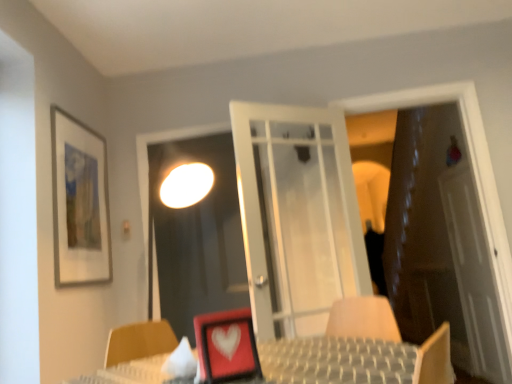
Find the location of a particular element. Image resolution: width=512 pixels, height=384 pixels. matte glass picture frame at upper left, positioned as the 2th picture frame in front-to-back order is located at coordinates (79, 202).

Where is `matte red picture frame at center, which is the first picture frame in right-to-left order`? matte red picture frame at center, which is the first picture frame in right-to-left order is located at coordinates (226, 346).

Where is `matte glass picture frame at upper left, positioned as the 2th picture frame in front-to-back order`? The height and width of the screenshot is (384, 512). matte glass picture frame at upper left, positioned as the 2th picture frame in front-to-back order is located at coordinates (79, 202).

Visually, is brown leather door at right positioned to the left or to the right of transparent glass screen door at center, which is counted as the second screen door, starting from the right?

brown leather door at right is positioned on transparent glass screen door at center, which is counted as the second screen door, starting from the right,'s right side.

From a real-world perspective, is brown leather door at right over transparent glass screen door at center, the second screen door from the back?

No, from a real-world perspective, brown leather door at right is not above transparent glass screen door at center, the second screen door from the back.

Considering the sizes of brown leather door at right and transparent glass screen door at center, which is counted as the second screen door, starting from the right, in the image, is brown leather door at right bigger or smaller than transparent glass screen door at center, which is counted as the second screen door, starting from the right,?

Considering their sizes, brown leather door at right takes up more space than transparent glass screen door at center, which is counted as the second screen door, starting from the right.

Which is more distant, (435, 135) or (217, 279)?

The point (435, 135) is farther.

Is white translucent screen door at right, marked as the 1th screen door in a right-to-left arrangement, shorter than transparent glass screen door at center, placed as the first screen door when sorted from front to back?

In fact, white translucent screen door at right, marked as the 1th screen door in a right-to-left arrangement, may be taller than transparent glass screen door at center, placed as the first screen door when sorted from front to back.

Is white translucent screen door at right, positioned as the 2th screen door in left-to-right order, with transparent glass screen door at center, the second screen door from the back?

They are not placed beside each other.

How much distance is there between white translucent screen door at right, arranged as the 2th screen door when viewed from the front, and transparent glass screen door at center, the second screen door from the back?

They are 6.40 feet apart.

Find the location of `screen door located behind the transparent glass screen door at center, the first screen door in the left-to-right sequence`. screen door located behind the transparent glass screen door at center, the first screen door in the left-to-right sequence is located at coordinates (473, 281).

Is brown leather door at right at the back of transparent glass screen door at center, the second screen door from the back?

That's not correct — transparent glass screen door at center, the second screen door from the back, is not looking away from brown leather door at right.

Where is `door that is below the transparent glass screen door at center, placed as the first screen door when sorted from front to back (from the image's perspective)`? The image size is (512, 384). door that is below the transparent glass screen door at center, placed as the first screen door when sorted from front to back (from the image's perspective) is located at coordinates (441, 244).

Considering the sizes of transparent glass screen door at center, the second screen door from the back, and brown leather door at right in the image, is transparent glass screen door at center, the second screen door from the back, bigger or smaller than brown leather door at right?

transparent glass screen door at center, the second screen door from the back, is smaller than brown leather door at right.

Does point (219, 232) appear closer or farther from the camera than point (476, 266)?

Clearly, point (219, 232) is closer to the camera than point (476, 266).

Considering the relative sizes of white translucent screen door at right, which is counted as the 1th screen door, starting from the back, and matte red picture frame at center, the second picture frame positioned from the left, in the image provided, is white translucent screen door at right, which is counted as the 1th screen door, starting from the back, shorter than matte red picture frame at center, the second picture frame positioned from the left,?

In fact, white translucent screen door at right, which is counted as the 1th screen door, starting from the back, may be taller than matte red picture frame at center, the second picture frame positioned from the left.

Does point (476, 329) appear closer or farther from the camera than point (251, 334)?

Clearly, point (476, 329) is more distant from the camera than point (251, 334).

Between white translucent screen door at right, arranged as the 2th screen door when viewed from the front, and matte red picture frame at center, which is the first picture frame from front to back, which one has smaller width?

Thinner between the two is white translucent screen door at right, arranged as the 2th screen door when viewed from the front.

How many degrees apart are the facing directions of brown leather door at right and matte glass picture frame at upper left, which is the second picture frame in right-to-left order?

90 degrees separate the facing orientations of brown leather door at right and matte glass picture frame at upper left, which is the second picture frame in right-to-left order.

Considering the positions of objects brown leather door at right and matte glass picture frame at upper left, which is the second picture frame in right-to-left order, in the image provided, who is in front, brown leather door at right or matte glass picture frame at upper left, which is the second picture frame in right-to-left order,?

Answer: matte glass picture frame at upper left, which is the second picture frame in right-to-left order, is closer to the camera.

Are brown leather door at right and matte glass picture frame at upper left, positioned as the first picture frame in back-to-front order, making contact?

No, brown leather door at right is not making contact with matte glass picture frame at upper left, positioned as the first picture frame in back-to-front order.

Looking at this image, could you measure the distance between brown leather door at right and matte glass picture frame at upper left, arranged as the first picture frame when viewed from the left?

A distance of 9.33 feet exists between brown leather door at right and matte glass picture frame at upper left, arranged as the first picture frame when viewed from the left.

Which is behind, matte red picture frame at center, which is the first picture frame from front to back, or matte glass picture frame at upper left, positioned as the first picture frame in back-to-front order?

matte glass picture frame at upper left, positioned as the first picture frame in back-to-front order, is further from the camera.

Is matte red picture frame at center, the second picture frame positioned from the left, completely or partially outside of matte glass picture frame at upper left, arranged as the first picture frame when viewed from the left?

matte red picture frame at center, the second picture frame positioned from the left, lies outside matte glass picture frame at upper left, arranged as the first picture frame when viewed from the left,'s area.

Between point (219, 341) and point (98, 224), which one is positioned behind?

Positioned behind is point (98, 224).

From a real-world perspective, between matte red picture frame at center, the second picture frame positioned from the left, and matte glass picture frame at upper left, which is the second picture frame in right-to-left order, who is vertically lower?

matte red picture frame at center, the second picture frame positioned from the left.

Does matte red picture frame at center, which is the first picture frame in right-to-left order, come in front of transparent glass screen door at center, which is counted as the second screen door, starting from the right?

Yes, the depth of matte red picture frame at center, which is the first picture frame in right-to-left order, is less than that of transparent glass screen door at center, which is counted as the second screen door, starting from the right.

Is point (204, 334) farther from viewer compared to point (170, 241)?

No, it is in front of (170, 241).

Does matte red picture frame at center, the second picture frame positioned from the left, have a greater width compared to transparent glass screen door at center, the second screen door from the back?

Yes.

Who is taller, matte red picture frame at center, the second picture frame positioned from the left, or transparent glass screen door at center, the second screen door from the back?

transparent glass screen door at center, the second screen door from the back, is taller.

In the image, there is a transparent glass screen door at center, the second screen door from the back. Where is `door below it (from a real-world perspective)`? This screenshot has height=384, width=512. door below it (from a real-world perspective) is located at coordinates (441, 244).

This screenshot has width=512, height=384. Find the location of `screen door on the right of transparent glass screen door at center, the first screen door in the left-to-right sequence`. screen door on the right of transparent glass screen door at center, the first screen door in the left-to-right sequence is located at coordinates (473, 281).

When comparing their distances from transparent glass screen door at center, which is counted as the second screen door, starting from the right, does matte glass picture frame at upper left, arranged as the first picture frame when viewed from the left, or matte red picture frame at center, which is the first picture frame from front to back, seem further?

matte red picture frame at center, which is the first picture frame from front to back.

When comparing their distances from transparent glass screen door at center, placed as the first screen door when sorted from front to back, does brown leather door at right or white translucent screen door at right, positioned as the 2th screen door in left-to-right order, seem further?

Among the two, brown leather door at right is located further to transparent glass screen door at center, placed as the first screen door when sorted from front to back.

Which object lies nearer to the anchor point matte red picture frame at center, the second picture frame positioned from the left, matte glass picture frame at upper left, positioned as the first picture frame in back-to-front order, or transparent glass screen door at center, placed as the first screen door when sorted from front to back?

matte glass picture frame at upper left, positioned as the first picture frame in back-to-front order, is positioned closer to the anchor matte red picture frame at center, the second picture frame positioned from the left.

When comparing their distances from white translucent screen door at right, positioned as the 2th screen door in left-to-right order, does matte red picture frame at center, the second picture frame positioned from the left, or matte glass picture frame at upper left, positioned as the 2th picture frame in front-to-back order, seem closer?

Among the two, matte red picture frame at center, the second picture frame positioned from the left, is located nearer to white translucent screen door at right, positioned as the 2th screen door in left-to-right order.

From the image, which object appears to be farther from white translucent screen door at right, marked as the 1th screen door in a right-to-left arrangement, matte glass picture frame at upper left, positioned as the 2th picture frame in front-to-back order, or transparent glass screen door at center, the second screen door from the back?

Among the two, matte glass picture frame at upper left, positioned as the 2th picture frame in front-to-back order, is located further to white translucent screen door at right, marked as the 1th screen door in a right-to-left arrangement.

Considering their positions, is matte red picture frame at center, the 2th picture frame from the back, positioned closer to brown leather door at right than white translucent screen door at right, marked as the 1th screen door in a right-to-left arrangement?

Based on the image, white translucent screen door at right, marked as the 1th screen door in a right-to-left arrangement, appears to be nearer to brown leather door at right.

Estimate the real-world distances between objects in this image. Which object is further from transparent glass screen door at center, the first screen door in the left-to-right sequence, matte red picture frame at center, which is the first picture frame from front to back, or brown leather door at right?

Based on the image, brown leather door at right appears to be further to transparent glass screen door at center, the first screen door in the left-to-right sequence.

Based on their spatial positions, is transparent glass screen door at center, the second screen door from the back, or matte glass picture frame at upper left, arranged as the first picture frame when viewed from the left, closer to white translucent screen door at right, which is counted as the 1th screen door, starting from the back?

transparent glass screen door at center, the second screen door from the back, is positioned closer to the anchor white translucent screen door at right, which is counted as the 1th screen door, starting from the back.

Locate an element on the screen. The image size is (512, 384). picture frame between matte glass picture frame at upper left, positioned as the 2th picture frame in front-to-back order, and white translucent screen door at right, which is counted as the 1th screen door, starting from the back is located at coordinates (226, 346).

Where is `door between matte red picture frame at center, the second picture frame positioned from the left, and white translucent screen door at right, which is counted as the 1th screen door, starting from the back, from front to back`? The image size is (512, 384). door between matte red picture frame at center, the second picture frame positioned from the left, and white translucent screen door at right, which is counted as the 1th screen door, starting from the back, from front to back is located at coordinates (441, 244).

I want to click on picture frame located between transparent glass screen door at center, the first screen door in the left-to-right sequence, and white translucent screen door at right, arranged as the 2th screen door when viewed from the front, in the left-right direction, so click(x=226, y=346).

The image size is (512, 384). I want to click on screen door located between matte glass picture frame at upper left, arranged as the first picture frame when viewed from the left, and white translucent screen door at right, positioned as the 2th screen door in left-to-right order, in the left-right direction, so click(198, 235).